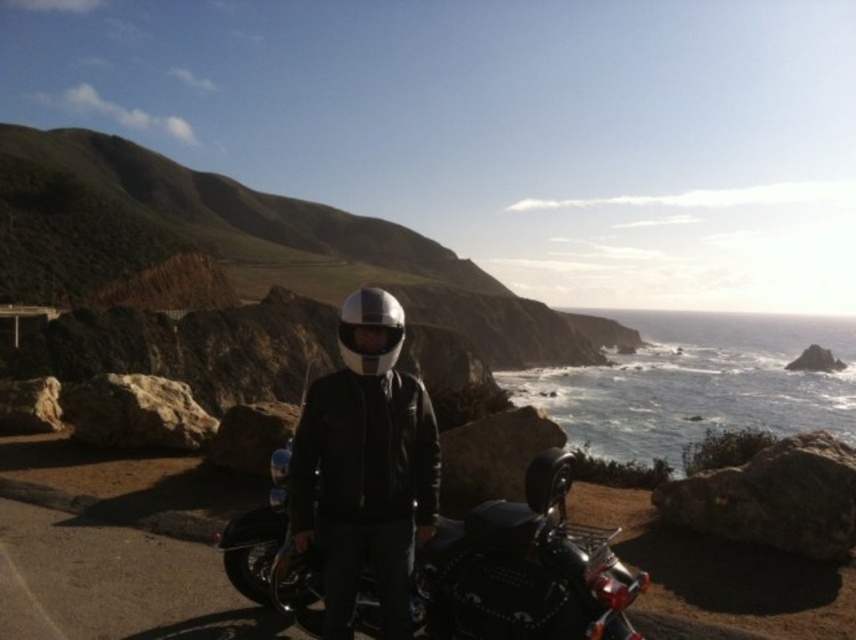
Question: Which point is farther to the camera?

Choices:
 (A) 269,518
 (B) 349,353
 (C) 428,433

Answer: (A)

Question: Which object is closer to the camera taking this photo?

Choices:
 (A) glossy metallic helmet at center
 (B) shiny black helmet at center

Answer: (B)

Question: Is shiny chrome motorcycle at center below shiny black helmet at center?

Choices:
 (A) no
 (B) yes

Answer: (B)

Question: Is shiny black helmet at center to the right of glossy metallic helmet at center from the viewer's perspective?

Choices:
 (A) yes
 (B) no

Answer: (A)

Question: Is shiny chrome motorcycle at center below shiny black helmet at center?

Choices:
 (A) no
 (B) yes

Answer: (B)

Question: Which of the following is the farthest from the observer?

Choices:
 (A) shiny black helmet at center
 (B) shiny chrome motorcycle at center

Answer: (A)